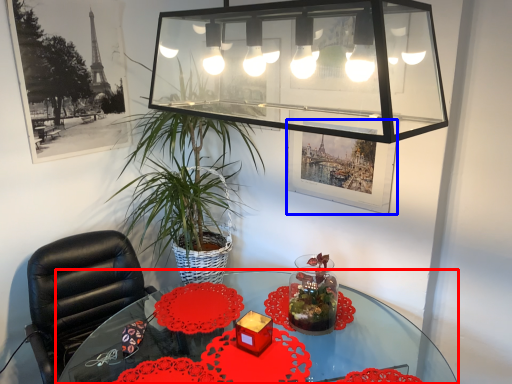
Question: Which point is further to the camera, table (highlighted by a red box) or picture frame (highlighted by a blue box)?

Choices:
 (A) table
 (B) picture frame

Answer: (B)